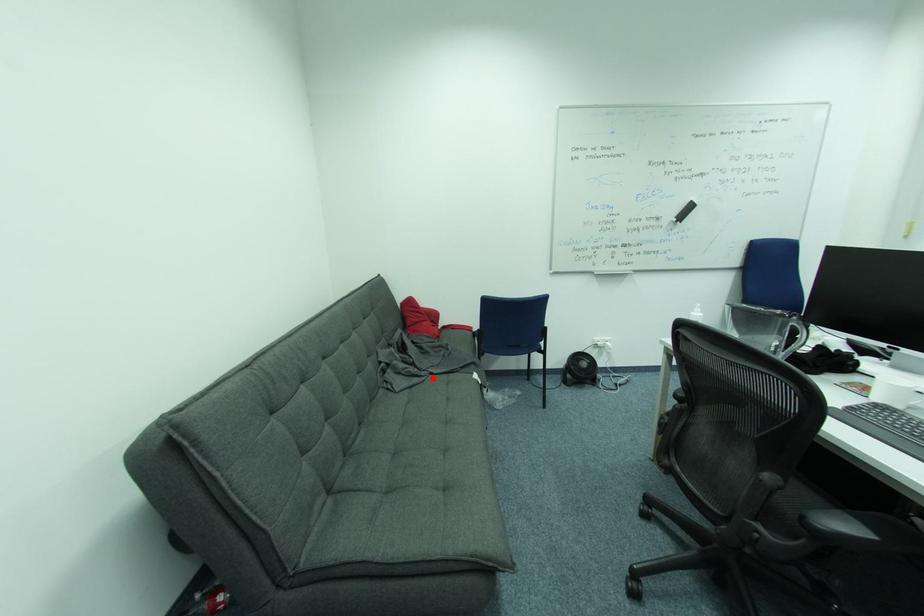
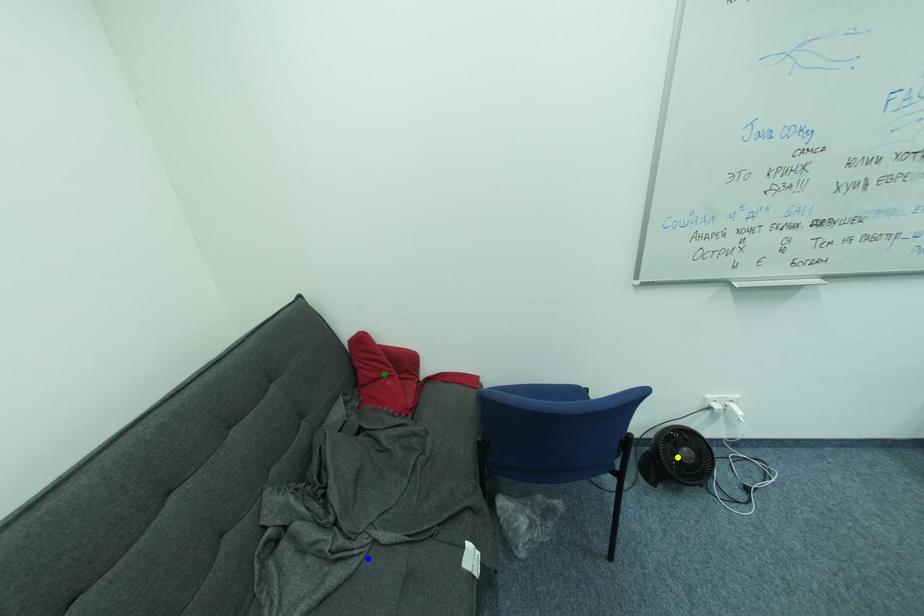
Question: I am providing you with two images of the same scene from different viewpoints. A red point is marked on the first image. You are given multiple points on the second image. Which mark in image 2 goes with the point in image 1?

Choices:
 (A) green point
 (B) yellow point
 (C) blue point

Answer: (C)